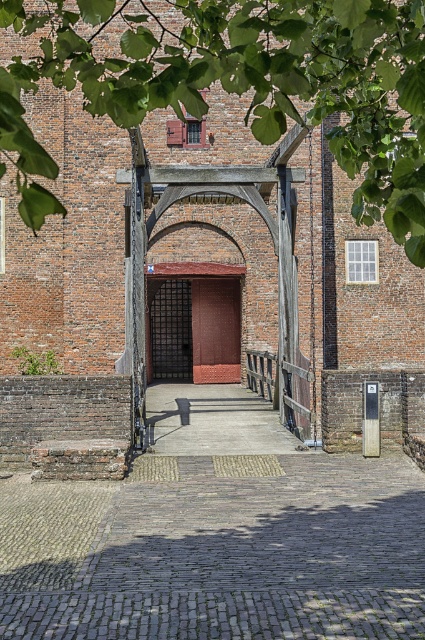
Who is more forward, (224, 364) or (172, 360)?

Positioned in front is point (224, 364).

Is brown wooden door at center bigger than black metal gate at center?

No.

Does point (195, 320) lie in front of point (170, 344)?

Yes, it is in front of point (170, 344).

The image size is (425, 640). Identify the location of brown wooden door at center. (215, 330).

The width and height of the screenshot is (425, 640). I want to click on green leafy tree at upper center, so click(240, 83).

Is green leafy tree at upper center further to the viewer compared to black metal gate at center?

No, it is not.

Does point (269, 48) lie behind point (187, 288)?

No, it is not.

Where is `green leafy tree at upper center`? The height and width of the screenshot is (640, 425). green leafy tree at upper center is located at coordinates (240, 83).

Is point (288, 113) positioned after point (227, 381)?

No, (288, 113) is closer to viewer.

Based on the photo, who is lower down, green leafy tree at upper center or rustic wooden door at center?

rustic wooden door at center is lower down.

Is point (16, 4) positioned in front of point (169, 312)?

Yes, point (16, 4) is in front of point (169, 312).

This screenshot has width=425, height=640. Identify the location of green leafy tree at upper center. (240, 83).